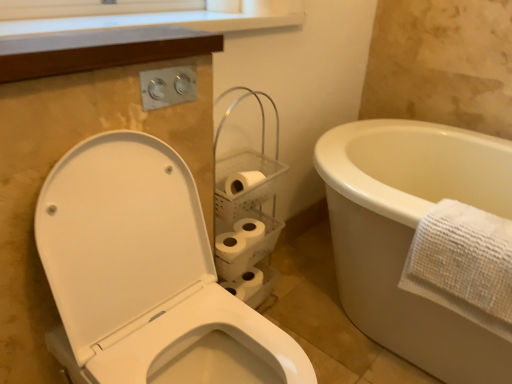
Question: Visually, is white glossy toilet at left positioned to the left or to the right of white textured towel at right?

Choices:
 (A) right
 (B) left

Answer: (B)

Question: From a real-world perspective, relative to white textured towel at right, is white glossy toilet at left vertically above or below?

Choices:
 (A) above
 (B) below

Answer: (B)

Question: Which object is positioned farthest from the white matte toilet paper at center?

Choices:
 (A) white textured towel at right
 (B) white glossy toilet at left

Answer: (A)

Question: Estimate the real-world distances between objects in this image. Which object is farther from the white glossy toilet at left?

Choices:
 (A) white matte toilet paper at center
 (B) white textured towel at right

Answer: (B)